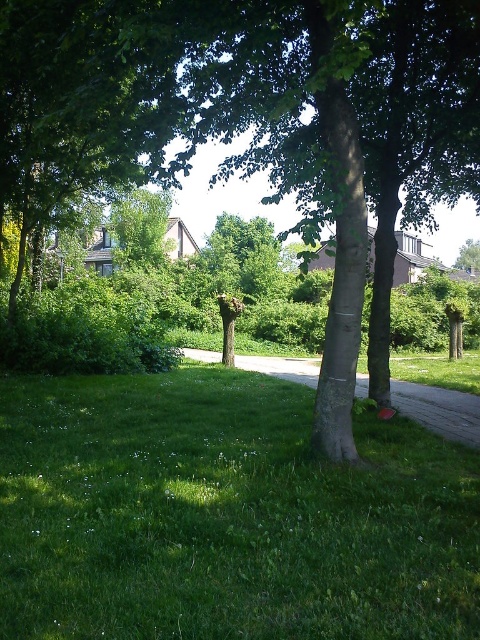
Which is in front, point (430, 621) or point (340, 429)?

Point (430, 621) is in front.

Between point (118, 630) and point (50, 68), which one is positioned behind?

The point (50, 68) is more distant.

At what (x,y) coordinates should I click in order to perform the action: click on green grass at lower left. Please return your answer as a coordinate pair (x, y). Image resolution: width=480 pixels, height=640 pixels. Looking at the image, I should click on (226, 515).